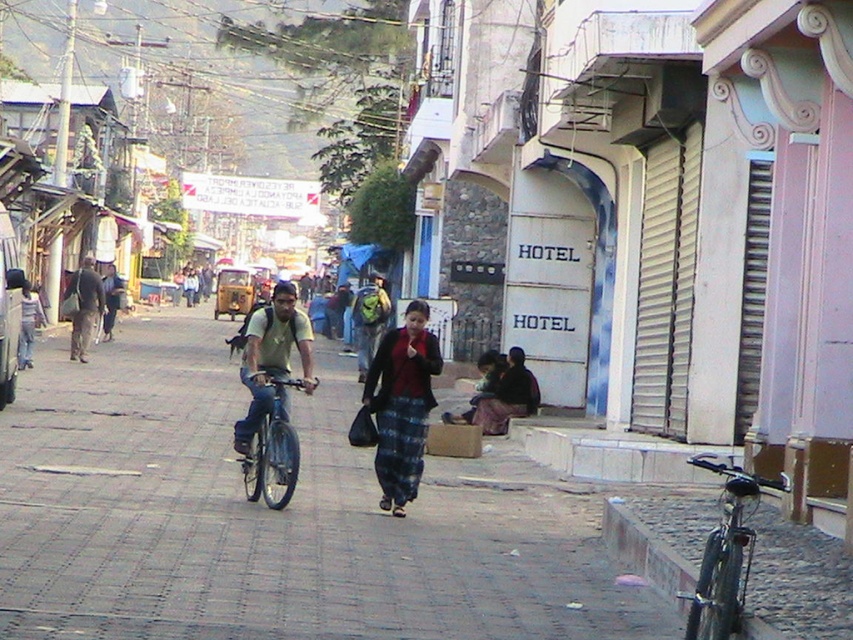
Looking at this image, does blue plaid skirt at center have a smaller size compared to dark gray backpack at left?

No, blue plaid skirt at center is not smaller than dark gray backpack at left.

The width and height of the screenshot is (853, 640). In order to click on blue plaid skirt at center in this screenshot , I will do `click(402, 404)`.

Where is `blue plaid skirt at center`? The width and height of the screenshot is (853, 640). blue plaid skirt at center is located at coordinates (402, 404).

Consider the image. Between dark brown fabric at lower right and dark blue fabric at lower right, which one appears on the right side from the viewer's perspective?

dark brown fabric at lower right is more to the right.

Is dark brown fabric at lower right bigger than dark blue fabric at lower right?

Actually, dark brown fabric at lower right might be smaller than dark blue fabric at lower right.

Where is `dark brown fabric at lower right`? Image resolution: width=853 pixels, height=640 pixels. dark brown fabric at lower right is located at coordinates (508, 396).

Does matte green t-shirt at center appear on the left side of dark brown fabric at lower right?

Yes, matte green t-shirt at center is to the left of dark brown fabric at lower right.

Locate an element on the screen. This screenshot has height=640, width=853. matte green t-shirt at center is located at coordinates coord(271,358).